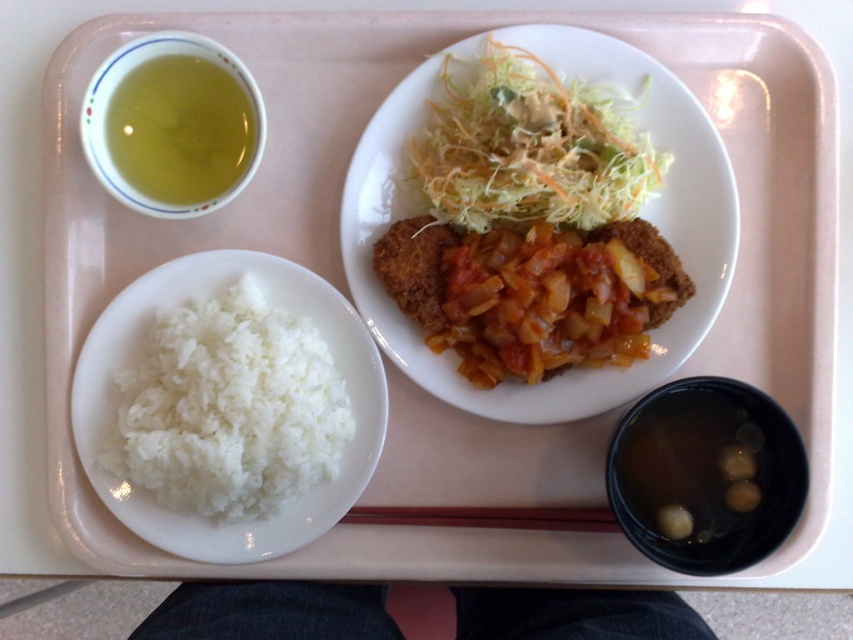
Question: Does golden brown fried chicken at center appear over white matte rice at lower left?

Choices:
 (A) no
 (B) yes

Answer: (B)

Question: Which object is farther from the camera taking this photo?

Choices:
 (A) golden brown fried chicken at center
 (B) shredded green salad at upper center
 (C) brown wood chopsticks at center

Answer: (C)

Question: Based on their relative distances, which object is farther from the white matte rice at lower left?

Choices:
 (A) brown wood chopsticks at center
 (B) golden brown fried chicken at center
 (C) shredded green salad at upper center

Answer: (C)

Question: Can you confirm if golden brown fried chicken at center is positioned below white matte rice at lower left?

Choices:
 (A) no
 (B) yes

Answer: (A)

Question: Which point is closer to the camera?

Choices:
 (A) (434, 134)
 (B) (723, 180)
 (C) (564, 516)

Answer: (B)

Question: Does shredded green salad at upper center lie behind brown wood chopsticks at center?

Choices:
 (A) yes
 (B) no

Answer: (B)